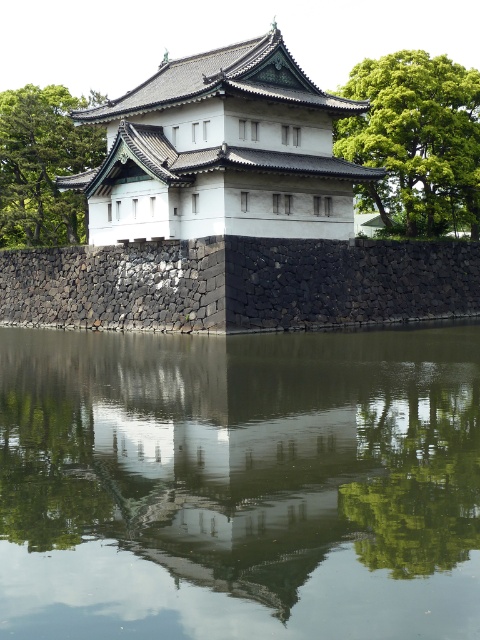
Is green reflective water at center below black stone wall at lower center?

Correct, green reflective water at center is located below black stone wall at lower center.

The height and width of the screenshot is (640, 480). Find the location of `green reflective water at center`. green reflective water at center is located at coordinates (240, 484).

Identify the location of green reflective water at center. (240, 484).

Where is `green reflective water at center`? green reflective water at center is located at coordinates (240, 484).

Is black stone wall at lower center shorter than green leafy tree at left?

Indeed, black stone wall at lower center has a lesser height compared to green leafy tree at left.

Who is more distant from viewer, (357, 262) or (59, 122)?

Positioned behind is point (59, 122).

In order to click on black stone wall at lower center in this screenshot , I will do `click(240, 284)`.

Identify the location of white stone building at center. Image resolution: width=480 pixels, height=640 pixels. (222, 150).

Is white stone building at center taller than black stone wall at lower center?

Indeed, white stone building at center has a greater height compared to black stone wall at lower center.

Is point (115, 209) positioned after point (206, 240)?

That is True.

You are a GUI agent. You are given a task and a screenshot of the screen. Output one action in this format:
    pyautogui.click(x=<x>, y=<y>)
    Task: Click on the white stone building at center
    The image size is (480, 640).
    Given the screenshot: What is the action you would take?
    pyautogui.click(x=222, y=150)